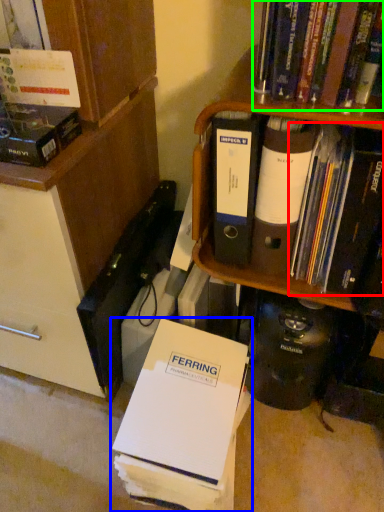
Question: Which object is the closest to the book (highlighted by a red box)? Choose among these: book (highlighted by a blue box) or book (highlighted by a green box).

Choices:
 (A) book
 (B) book

Answer: (B)